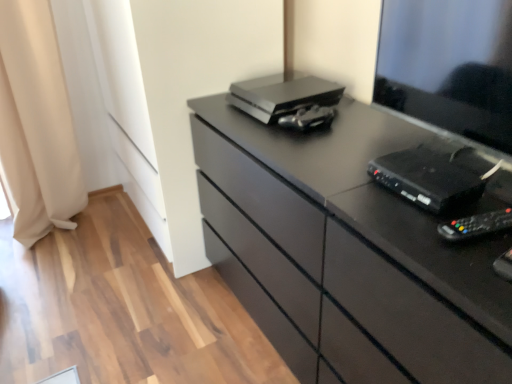
Find the location of `free spot in front of black plastic remote control at right, the 3th equipment viewed from the top`. free spot in front of black plastic remote control at right, the 3th equipment viewed from the top is located at coordinates (480, 272).